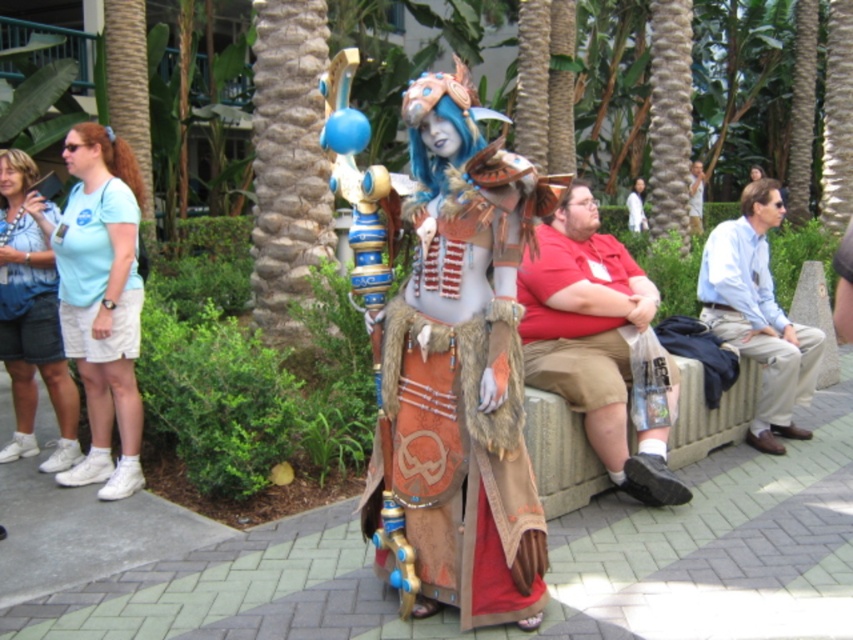
You are organizing a costume parade and need to arrange the light blue fabric shirt at upper left and the light blue shirt at right based on their size. Which one should you place first in a size order from smallest to largest?

The light blue fabric shirt at upper left should be placed first in the size order from smallest to largest because it occupies less space than the light blue shirt at right.

You are a photographer at a festival and need to capture a group photo of the matte blue shirt at left and the light blue shirt at center. The camera you have can focus on subjects within a 10 meter range. Will both shirts be in focus if you position the camera exactly between them?

The matte blue shirt at left and light blue shirt at center are 9.87 meters apart. Since the camera can focus within a 10 meter range, positioning it exactly between them would mean each is about 4.935 meters from the camera, well within the 10 meter limit. Both will be in focus.

You are an event organizer at this tropical gathering and need to arrange seating based on the attendees clothing. You notice two light blue shirts in the crowd. The light blue fabric shirt at upper left and the light blue shirt at right. Which one is narrower?

The light blue fabric shirt at upper left is narrower than the light blue shirt at right.